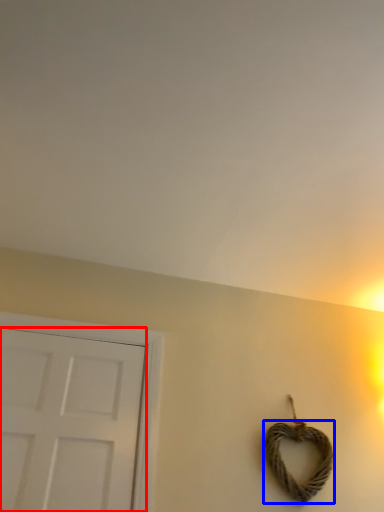
Question: Which of the following is the closest to the observer, door (highlighted by a red box) or rope (highlighted by a blue box)?

Choices:
 (A) door
 (B) rope

Answer: (A)